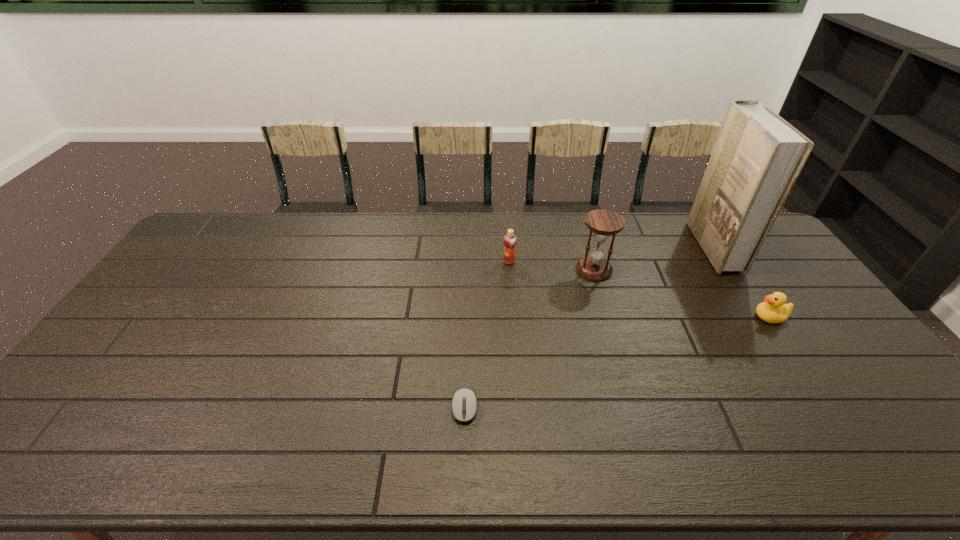
Find the location of `free space that satisfies the following two spatial constraints: 1. on the front side of the fourth object from right to left; 2. on the right side of the third object from right to left`. free space that satisfies the following two spatial constraints: 1. on the front side of the fourth object from right to left; 2. on the right side of the third object from right to left is located at coordinates (510, 270).

The width and height of the screenshot is (960, 540). I want to click on free space that satisfies the following two spatial constraints: 1. at the beak of the fourth farthest object; 2. on the wheel side of the computer equipment, so click(x=828, y=406).